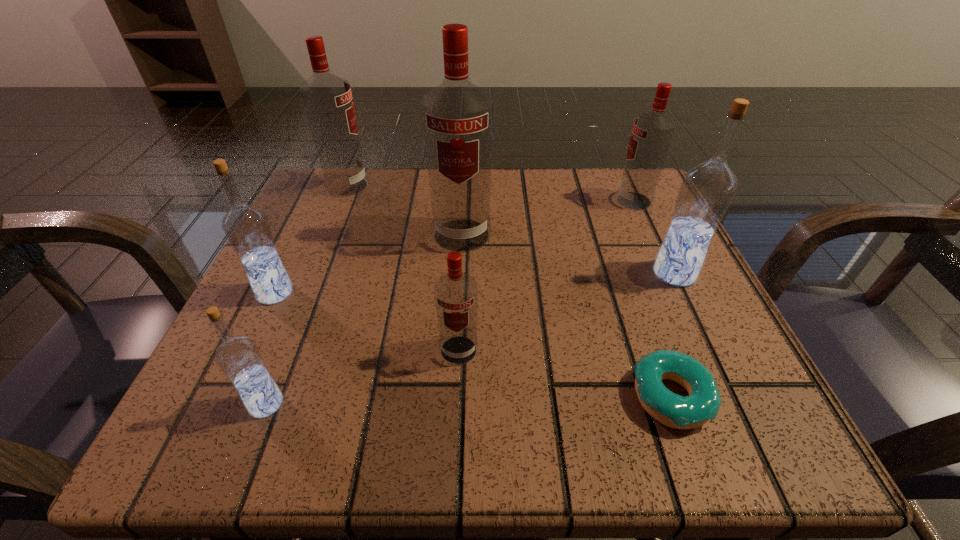
Locate an element on the screen. This screenshot has width=960, height=540. doughnut is located at coordinates (703, 403).

The image size is (960, 540). What are the coordinates of `vacant space located on the front label of the second nearest red vodka` in the screenshot? It's located at (456, 346).

You are a GUI agent. You are given a task and a screenshot of the screen. Output one action in this format:
    pyautogui.click(x=<x>, y=<y>)
    Task: Click on the vacant space located on the front label of the third smallest red vodka
    Image resolution: width=960 pixels, height=540 pixels.
    Given the screenshot: What is the action you would take?
    pyautogui.click(x=478, y=186)

Where is `free space located on the front of the biggest blue vodka`? This screenshot has width=960, height=540. free space located on the front of the biggest blue vodka is located at coordinates (748, 428).

This screenshot has width=960, height=540. What are the coordinates of `vacant space located 0.370m on the front label of the second smallest red vodka` in the screenshot? It's located at (440, 201).

Where is `vacant area located 0.240m on the front label of the second smallest red vodka`? The image size is (960, 540). vacant area located 0.240m on the front label of the second smallest red vodka is located at coordinates (502, 201).

Where is `free space located 0.280m on the front label of the second smallest red vodka`? The height and width of the screenshot is (540, 960). free space located 0.280m on the front label of the second smallest red vodka is located at coordinates pyautogui.click(x=483, y=201).

The width and height of the screenshot is (960, 540). I want to click on vacant space located 0.210m on the front of the leftmost blue vodka, so [210, 428].

The width and height of the screenshot is (960, 540). I want to click on vacant space situated on the front label of the smallest red vodka, so click(455, 425).

Where is `vacant point located on the back of the nearest vodka`? vacant point located on the back of the nearest vodka is located at coordinates (323, 262).